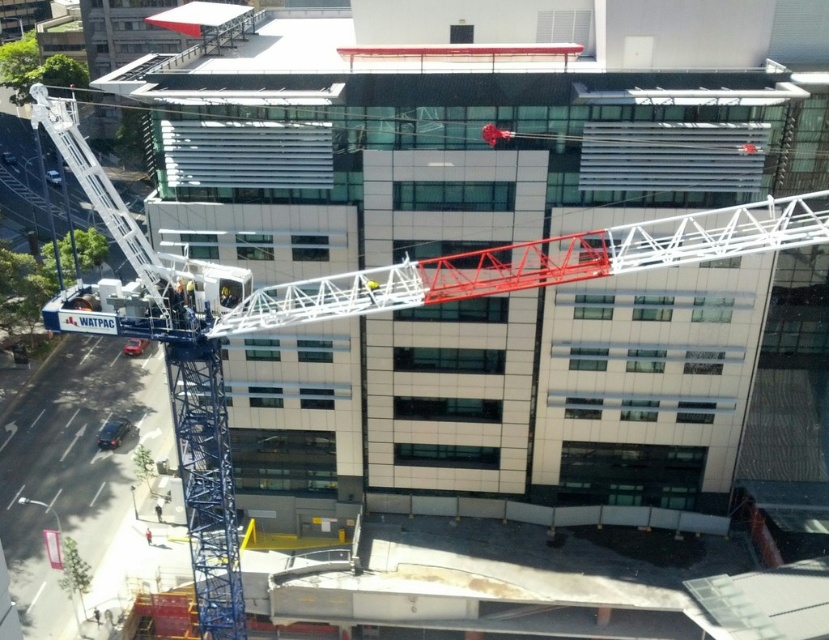
Is point (376, 285) more distant than point (148, 540)?

That is False.

Is yellow fabric construction worker at center further to the viewer compared to red shirt at center?

No, yellow fabric construction worker at center is closer to the viewer.

Based on the photo, who is more distant from viewer, (372, 285) or (144, 532)?

The point (144, 532) is behind.

The image size is (829, 640). What are the coordinates of `yellow fabric construction worker at center` in the screenshot? It's located at (371, 289).

Is white metallic ladder at left above red shirt at center?

Yes, white metallic ladder at left is above red shirt at center.

Does white metallic ladder at left appear on the left side of red shirt at center?

Correct, you'll find white metallic ladder at left to the left of red shirt at center.

Is point (139, 253) positioned behind point (146, 529)?

That is False.

The height and width of the screenshot is (640, 829). I want to click on white metallic ladder at left, so click(x=102, y=195).

Is point (158, 285) positioned before point (367, 284)?

Yes.

Between white metallic ladder at left and yellow fabric construction worker at center, which one appears on the right side from the viewer's perspective?

Positioned to the right is yellow fabric construction worker at center.

Where is `white metallic ladder at left`? white metallic ladder at left is located at coordinates (102, 195).

Where is `white metallic ladder at left`? This screenshot has width=829, height=640. white metallic ladder at left is located at coordinates pyautogui.click(x=102, y=195).